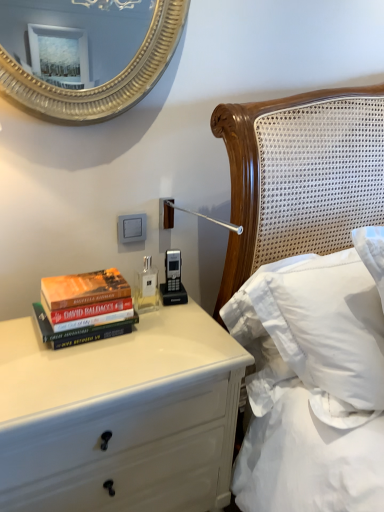
The width and height of the screenshot is (384, 512). In order to click on vacant space to the right of hardcover books at left in this screenshot , I will do `click(167, 335)`.